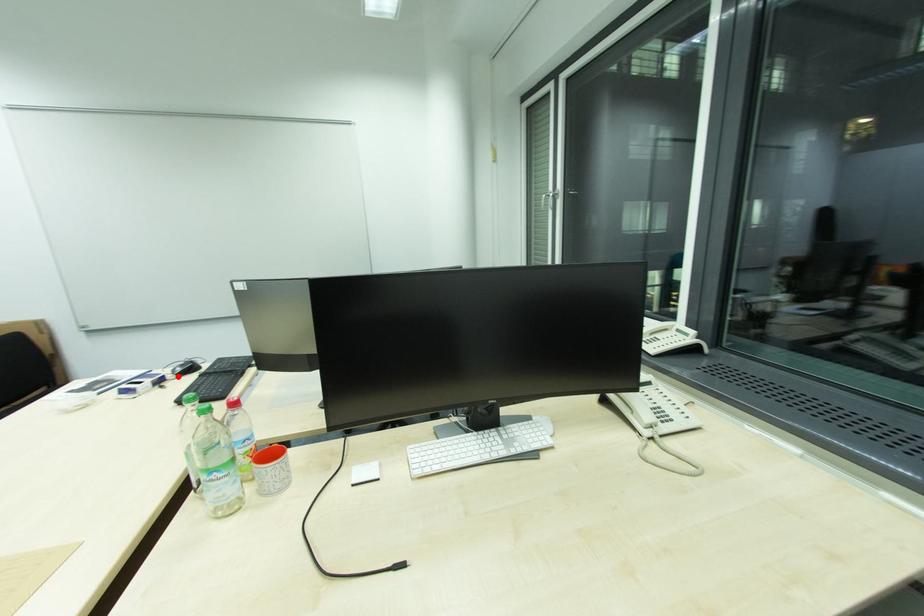
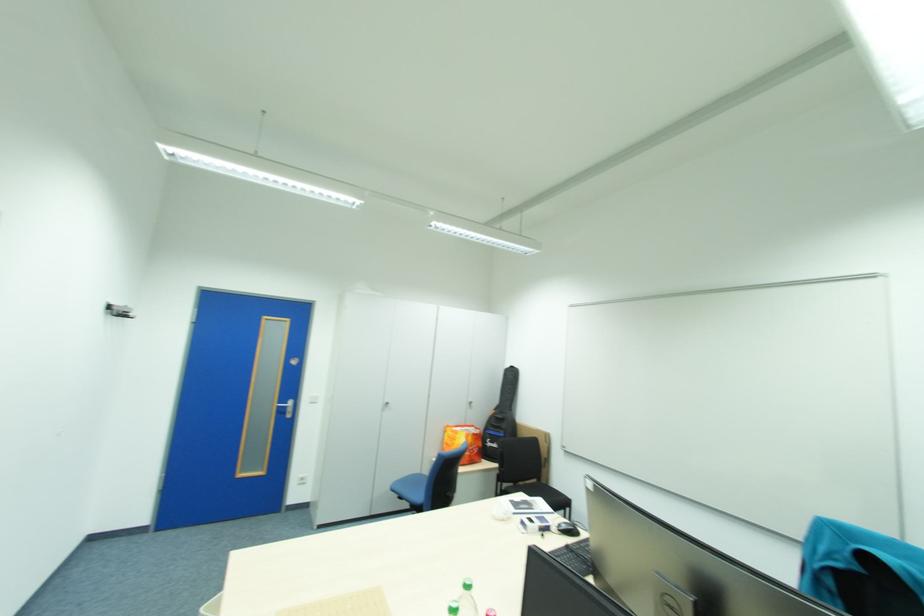
Question: I am providing you with two images of the same scene from different viewpoints. A red point is marked on the first image. Is the red point's position out of view in image 2?

Choices:
 (A) Yes
 (B) No

Answer: (B)